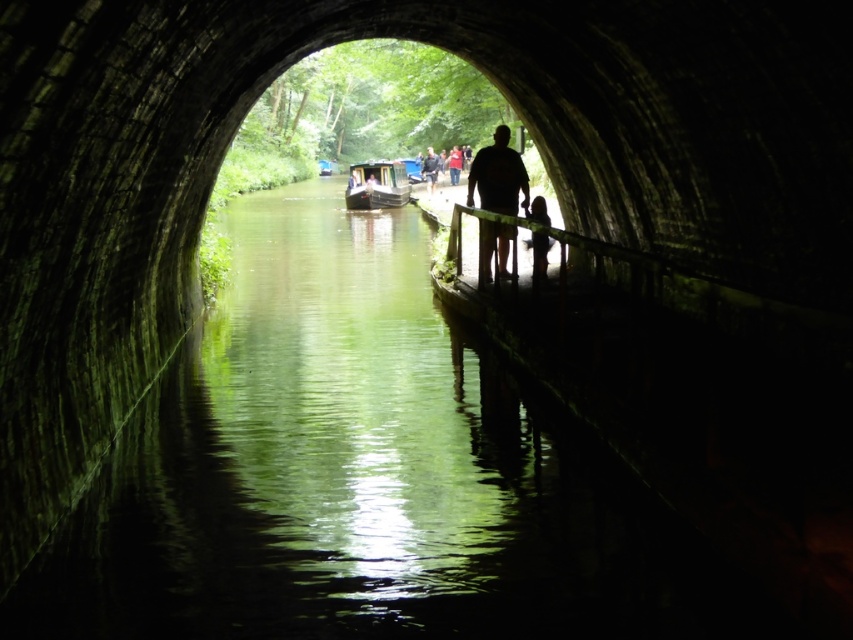
Which is below, silhouette wooden figure at center or dark blue shirt at center?

silhouette wooden figure at center is lower down.

Which is in front, point (486, 173) or point (428, 184)?

Positioned in front is point (486, 173).

Where is `silhouette wooden figure at center`? silhouette wooden figure at center is located at coordinates (498, 176).

Between point (485, 250) and point (351, 172), which one is positioned behind?

Point (351, 172)

Can you confirm if silhouette wooden figure at center is bigger than wooden polished boat at center?

No, silhouette wooden figure at center is not bigger than wooden polished boat at center.

Image resolution: width=853 pixels, height=640 pixels. Find the location of `silhouette wooden figure at center`. silhouette wooden figure at center is located at coordinates (498, 176).

Can you confirm if silhouette figure at center is positioned to the right of dark blue shirt at center?

Correct, you'll find silhouette figure at center to the right of dark blue shirt at center.

Between silhouette figure at center and dark blue shirt at center, which one is positioned lower?

Positioned lower is silhouette figure at center.

Does point (541, 209) come in front of point (439, 166)?

Yes, it is.

At what (x,y) coordinates should I click in order to perform the action: click on silhouette figure at center. Please return your answer as a coordinate pair (x, y). This screenshot has width=853, height=640. Looking at the image, I should click on (538, 252).